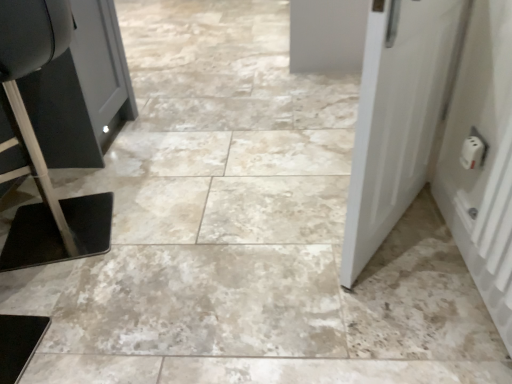
Question: Is white plastic door at right, arranged as the 2th door when viewed from the left, smaller than white matte door at right, positioned as the 2th door in right-to-left order?

Choices:
 (A) yes
 (B) no

Answer: (A)

Question: Can you confirm if white plastic door at right, marked as the first door in a right-to-left arrangement, is thinner than white matte door at right, the first door in the left-to-right sequence?

Choices:
 (A) yes
 (B) no

Answer: (A)

Question: From the image's perspective, would you say white plastic door at right, marked as the first door in a right-to-left arrangement, is shown under white matte door at right, the first door in the left-to-right sequence?

Choices:
 (A) no
 (B) yes

Answer: (B)

Question: Is white plastic door at right, marked as the first door in a right-to-left arrangement, shorter than white matte door at right, positioned as the 2th door in right-to-left order?

Choices:
 (A) yes
 (B) no

Answer: (A)

Question: From a real-world perspective, is white plastic door at right, marked as the first door in a right-to-left arrangement, positioned under white matte door at right, positioned as the 2th door in right-to-left order, based on gravity?

Choices:
 (A) no
 (B) yes

Answer: (A)

Question: From the image's perspective, is white plastic door at right, arranged as the 2th door when viewed from the left, on top of white matte door at right, the first door in the left-to-right sequence?

Choices:
 (A) yes
 (B) no

Answer: (B)

Question: Are white matte door at right, positioned as the 2th door in right-to-left order, and white plastic outlet at right far apart?

Choices:
 (A) no
 (B) yes

Answer: (A)

Question: Is white plastic outlet at right at the back of white matte door at right, positioned as the 2th door in right-to-left order?

Choices:
 (A) yes
 (B) no

Answer: (A)

Question: Considering the relative positions of white matte door at right, the first door in the left-to-right sequence, and white plastic outlet at right in the image provided, is white matte door at right, the first door in the left-to-right sequence, in front of white plastic outlet at right?

Choices:
 (A) no
 (B) yes

Answer: (B)

Question: Is white matte door at right, positioned as the 2th door in right-to-left order, taller than white plastic outlet at right?

Choices:
 (A) no
 (B) yes

Answer: (B)

Question: Is white matte door at right, the first door in the left-to-right sequence, wider than white plastic outlet at right?

Choices:
 (A) yes
 (B) no

Answer: (A)

Question: Is white matte door at right, the first door in the left-to-right sequence, bigger than white plastic outlet at right?

Choices:
 (A) no
 (B) yes

Answer: (B)

Question: From a real-world perspective, is white plastic door at right, marked as the first door in a right-to-left arrangement, over white plastic outlet at right?

Choices:
 (A) yes
 (B) no

Answer: (A)